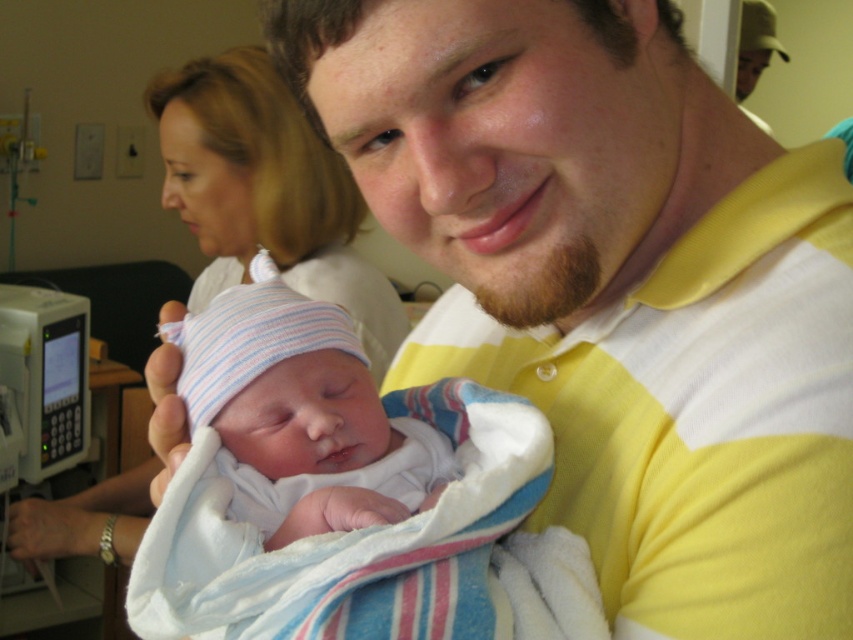
Is yellow striped polo shirt at center to the left of striped knit hat at center from the viewer's perspective?

In fact, yellow striped polo shirt at center is to the right of striped knit hat at center.

Is yellow striped polo shirt at center taller than striped knit hat at center?

Yes.

Describe the element at coordinates (616, 285) in the screenshot. I see `yellow striped polo shirt at center` at that location.

You are a GUI agent. You are given a task and a screenshot of the screen. Output one action in this format:
    pyautogui.click(x=<x>, y=<y>)
    Task: Click on the yellow striped polo shirt at center
    The width and height of the screenshot is (853, 640).
    Given the screenshot: What is the action you would take?
    pyautogui.click(x=616, y=285)

Does smooth white shirt at upper left appear over striped knit hat at center?

Yes.

Which is more to the right, smooth white shirt at upper left or striped knit hat at center?

striped knit hat at center is more to the right.

Is point (51, 518) less distant than point (254, 282)?

No, (51, 518) is further to viewer.

Locate an element on the screen. Image resolution: width=853 pixels, height=640 pixels. smooth white shirt at upper left is located at coordinates (265, 189).

Is point (456, 372) farther from camera compared to point (288, 164)?

No, it is in front of (288, 164).

The height and width of the screenshot is (640, 853). Find the location of `yellow striped polo shirt at center`. yellow striped polo shirt at center is located at coordinates (616, 285).